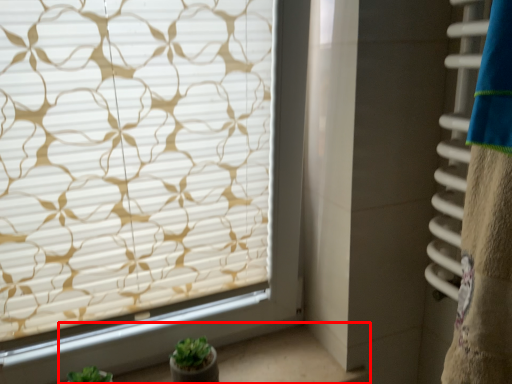
Question: From the image's perspective, what is the correct spatial relationship of window sill (annotated by the red box) in relation to window blind?

Choices:
 (A) below
 (B) above

Answer: (A)